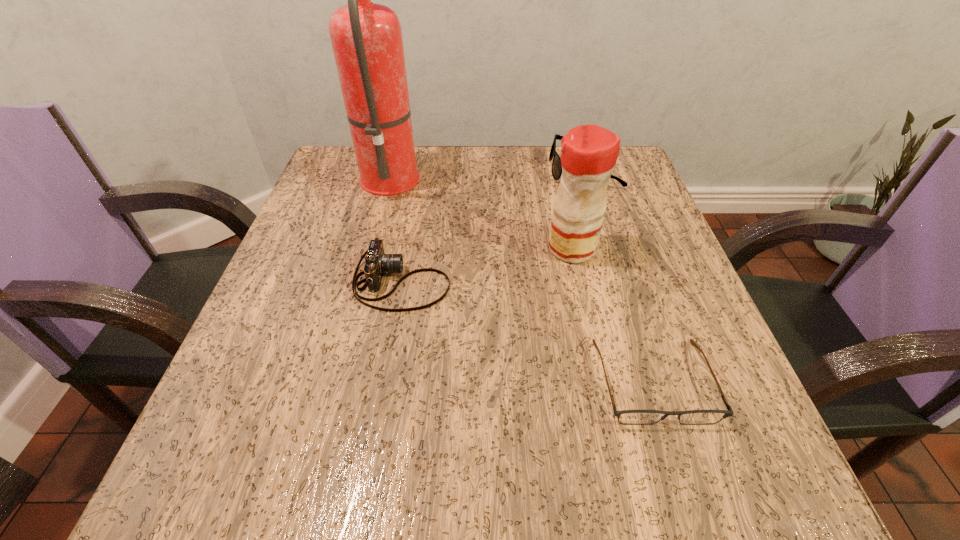
Find the location of a particular element. blank space located on the front-facing side of the sunglasses is located at coordinates (412, 171).

This screenshot has height=540, width=960. In order to click on free location located on the front-facing side of the camera in this screenshot , I will do `click(623, 282)`.

Locate an element on the screen. free spot located on the front-facing side of the spectacles is located at coordinates (679, 463).

Identify the location of fire extinguisher at the far edge. Image resolution: width=960 pixels, height=540 pixels. (366, 37).

Locate an element on the screen. sunglasses present at the far edge is located at coordinates (556, 169).

Where is `fire extinguisher positioned at the left edge`? The height and width of the screenshot is (540, 960). fire extinguisher positioned at the left edge is located at coordinates (366, 37).

At what (x,y) coordinates should I click in order to perform the action: click on camera that is at the left edge. Please return your answer as a coordinate pair (x, y). Looking at the image, I should click on (377, 262).

Identify the location of condiment that is positioned at the right edge. (589, 153).

Identify the location of sunglasses present at the right edge. The width and height of the screenshot is (960, 540). (556, 169).

Image resolution: width=960 pixels, height=540 pixels. Identify the location of spectacles present at the right edge. (630, 417).